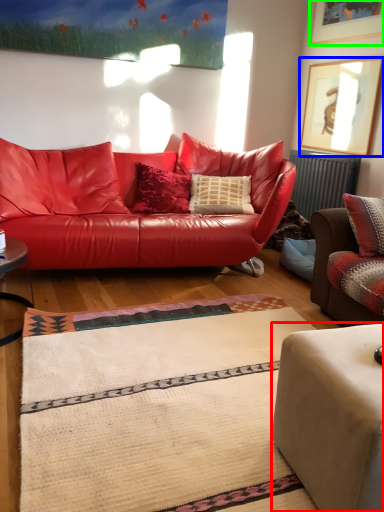
Question: Based on their relative distances, which object is farther from studio couch (highlighted by a red box)? Choose from picture frame (highlighted by a blue box) and picture frame (highlighted by a green box).

Choices:
 (A) picture frame
 (B) picture frame

Answer: (B)